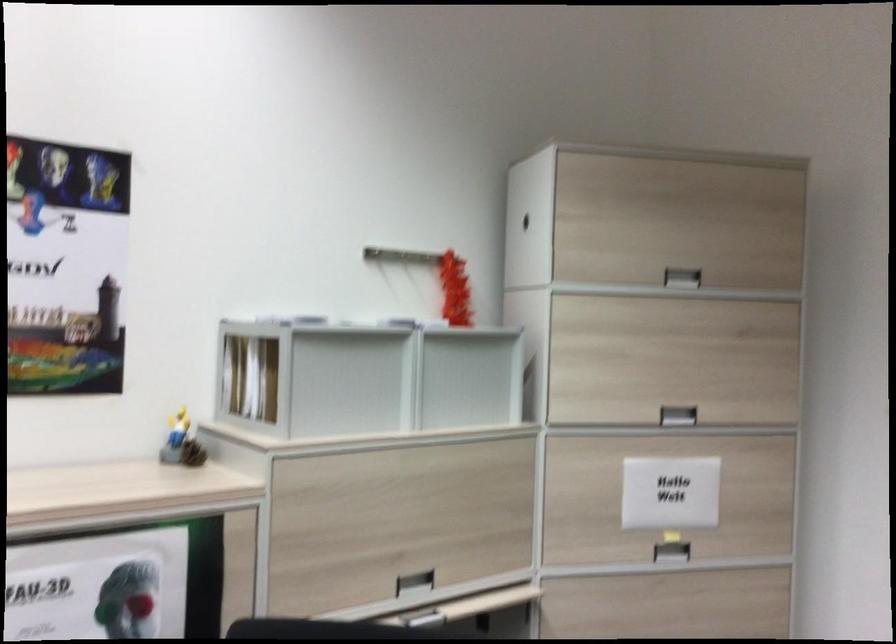
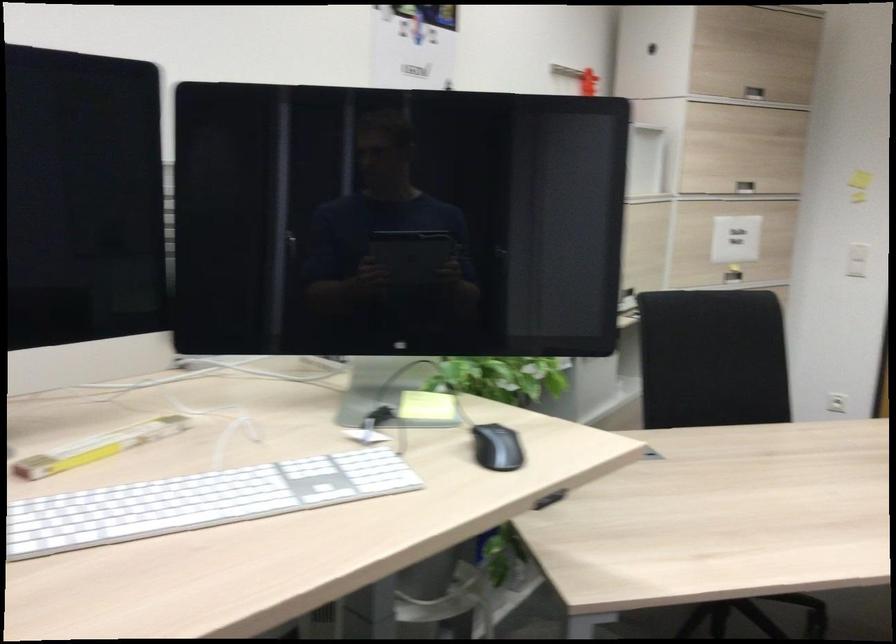
Question: I am providing you with two images of the same scene from different viewpoints. Please identify which objects are invisible in image2.

Choices:
 (A) brown trash can
 (B) yellow folding ruler
 (C) chair sitting surface
 (D) small pinecone

Answer: (D)